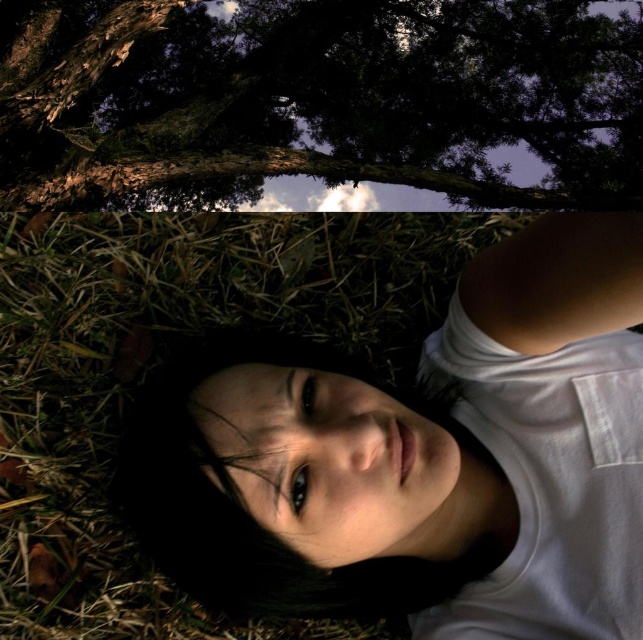
Which is behind, point (257, 593) or point (161, 13)?

The point (161, 13) is more distant.

Which of these two, white matte shirt at center or brown textured bark at upper center, stands taller?

Standing taller between the two is brown textured bark at upper center.

Does point (574, 512) lie in front of point (201, 33)?

Yes, point (574, 512) is closer to viewer.

Identify the location of white matte shirt at center. The image size is (643, 640). (424, 458).